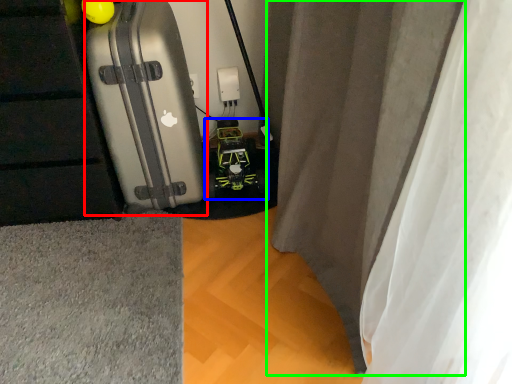
Question: Which object is the closest to the suitcase (highlighted by a red box)? Choose among these: toy car (highlighted by a blue box) or curtain (highlighted by a green box).

Choices:
 (A) toy car
 (B) curtain

Answer: (A)